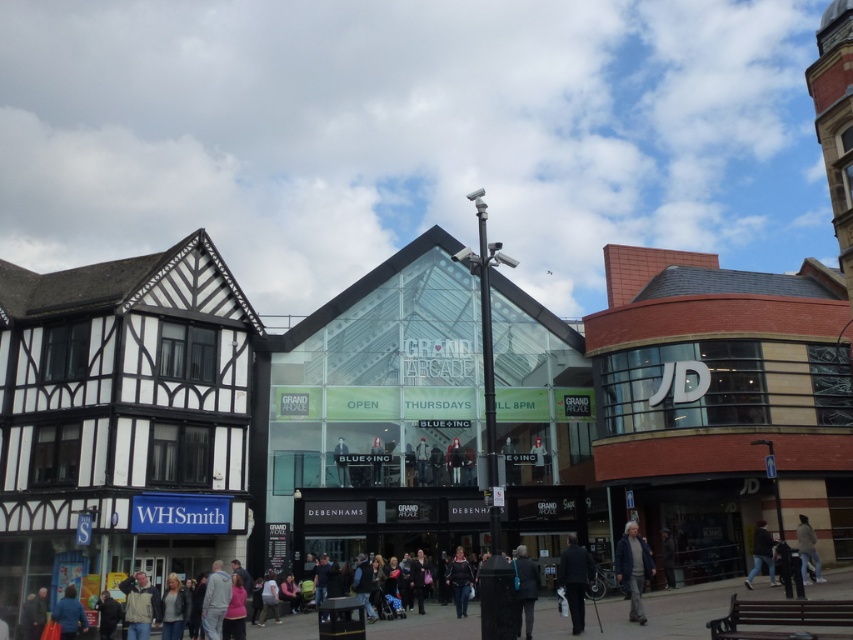
Between dark blue fabric jacket at lower center and dark gray suit at center, which one is positioned lower?

dark blue fabric jacket at lower center is below.

Does point (583, 614) come closer to viewer compared to point (525, 637)?

No, it is not.

Between point (592, 572) and point (532, 614), which one is positioned behind?

Point (592, 572)

Find the location of `dark blue fabric jacket at lower center`. dark blue fabric jacket at lower center is located at coordinates (575, 579).

From the picture: Between khaki jacket at lower left and dark gray suit at center, which one is positioned lower?

Positioned lower is khaki jacket at lower left.

Does khaki jacket at lower left have a greater width compared to dark gray suit at center?

Yes.

What are the coordinates of `khaki jacket at lower left` in the screenshot? It's located at (138, 605).

Between khaki jacket at lower left and dark blue jeans at lower right, which one is positioned lower?

Positioned lower is khaki jacket at lower left.

Is point (155, 618) positioned after point (764, 552)?

No, (155, 618) is in front of (764, 552).

Describe the element at coordinates (138, 605) in the screenshot. I see `khaki jacket at lower left` at that location.

At what (x,y) coordinates should I click in order to perform the action: click on khaki jacket at lower left. Please return your answer as a coordinate pair (x, y). The width and height of the screenshot is (853, 640). Looking at the image, I should click on (138, 605).